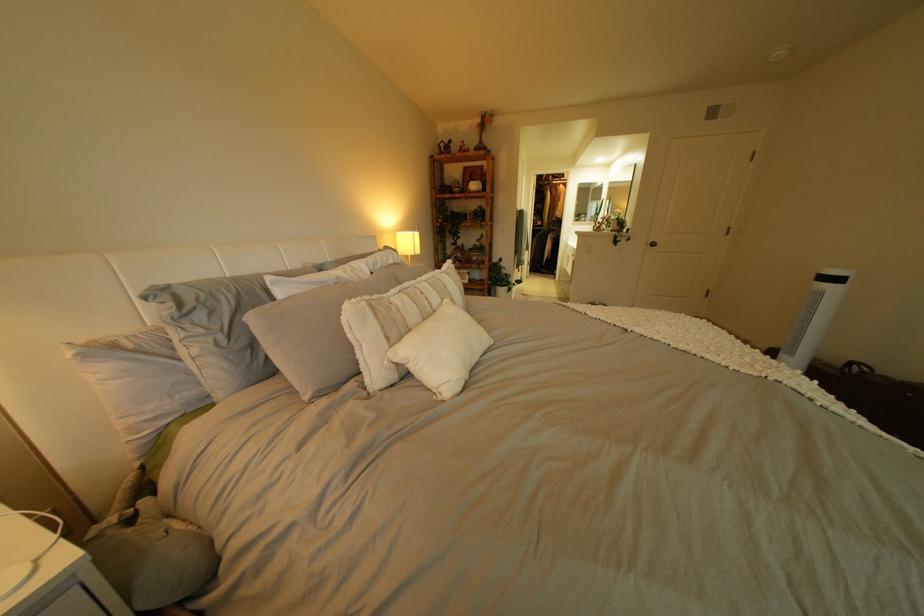
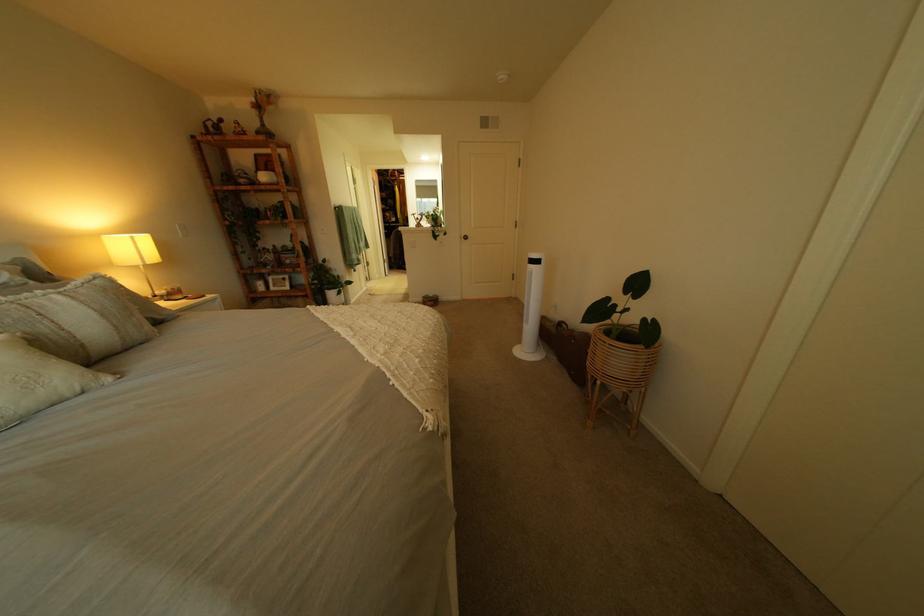
Question: What movement of the cameraman would produce the second image?

Choices:
 (A) Left
 (B) Right
 (C) Forward
 (D) Backward

Answer: (B)